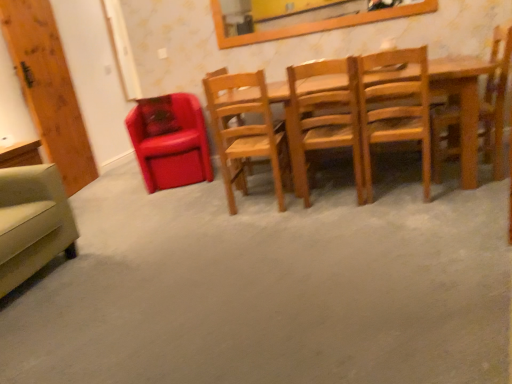
Where is `vacant space underneath wooden chair at center, which is the fourth chair from left to right (from a real-world perspective)`? The width and height of the screenshot is (512, 384). vacant space underneath wooden chair at center, which is the fourth chair from left to right (from a real-world perspective) is located at coordinates (330, 192).